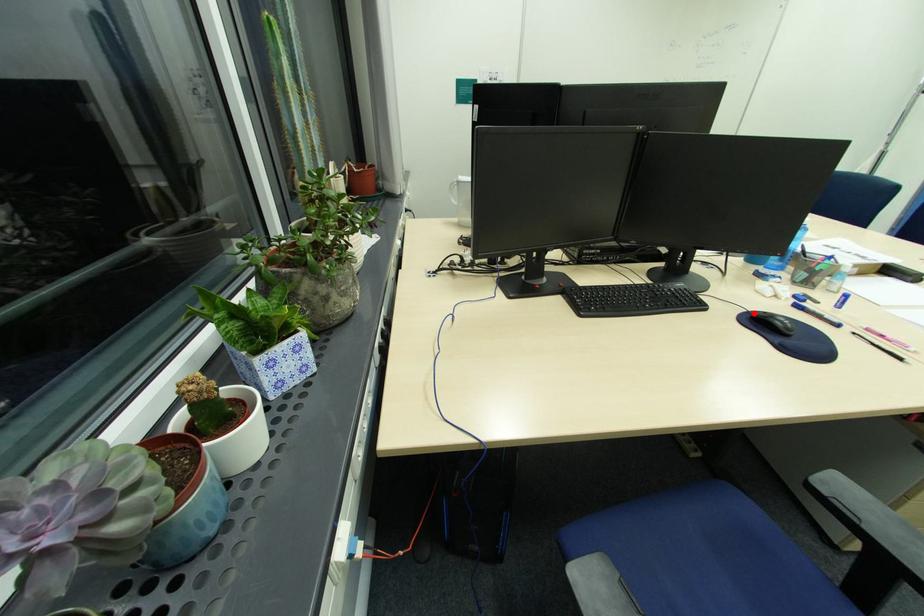
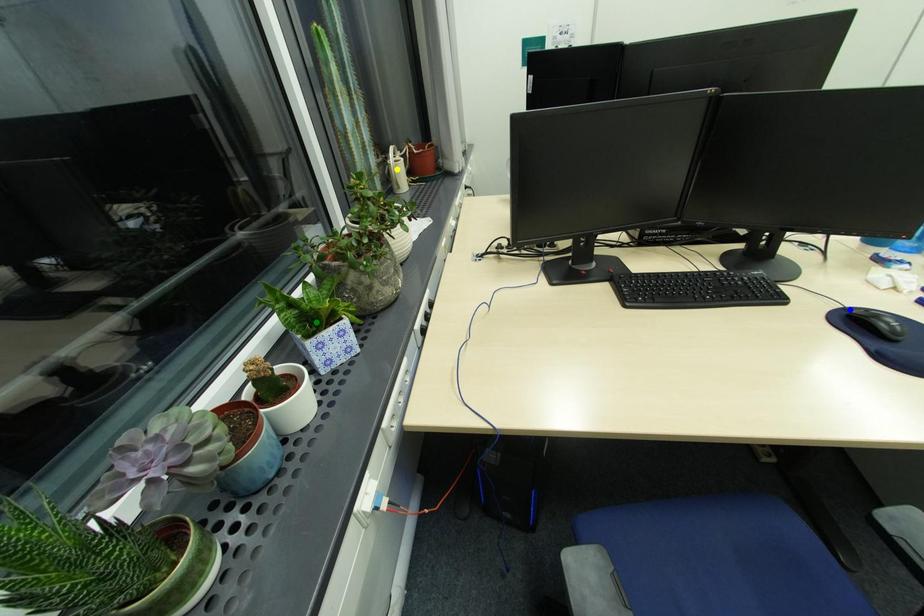
Question: I am providing you with two images of the same scene from different viewpoints. A red point is marked on the first image. You are given multiple points on the second image. Which mark in image 2 goes with the point in image 1?

Choices:
 (A) yellow point
 (B) green point
 (C) blue point

Answer: (C)